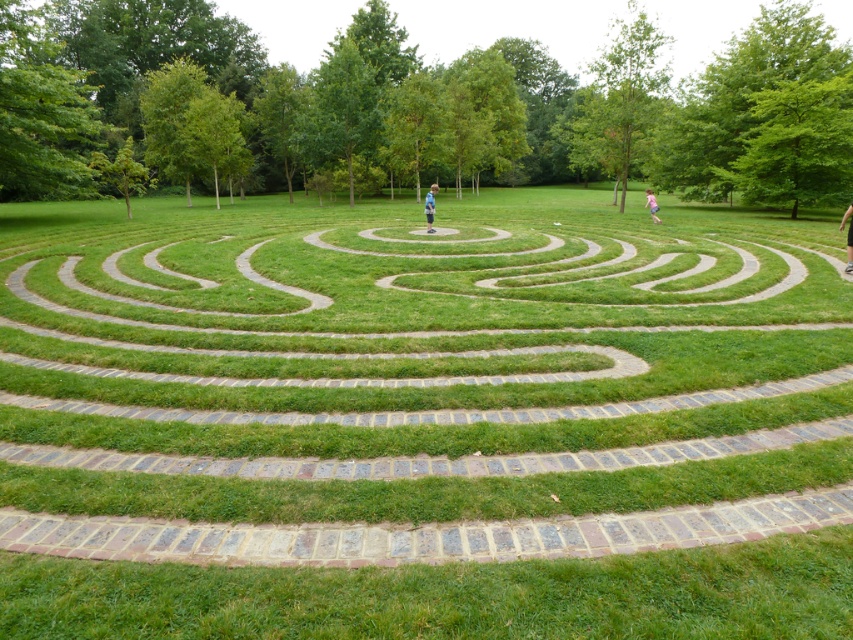
Question: Is green grass at center positioned at the back of blurred white shirt at upper center?

Choices:
 (A) no
 (B) yes

Answer: (A)

Question: Among these points, which one is nearest to the camera?

Choices:
 (A) (654, 209)
 (B) (848, 262)
 (C) (433, 192)

Answer: (B)

Question: Which of these objects is positioned closest to the green grass at center?

Choices:
 (A) blurred white shirt at upper center
 (B) blue denim jeans at center

Answer: (B)

Question: Which point is farther to the camera?

Choices:
 (A) (235, 291)
 (B) (426, 195)

Answer: (B)

Question: Does dark gray pants at center have a greater width compared to blurred white shirt at upper center?

Choices:
 (A) no
 (B) yes

Answer: (B)

Question: Does dark gray pants at center appear over blue denim jeans at center?

Choices:
 (A) no
 (B) yes

Answer: (A)